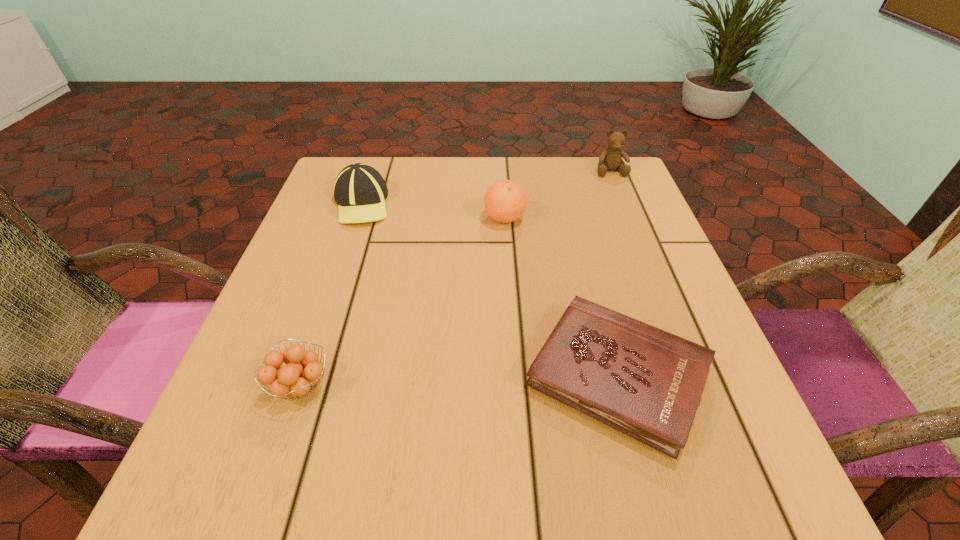
Where is `teddy bear`? teddy bear is located at coordinates (610, 159).

Where is `the right orange fruit`? The image size is (960, 540). the right orange fruit is located at coordinates (505, 201).

Locate an element on the screen. the taller orange fruit is located at coordinates (505, 201).

At what (x,y) coordinates should I click in order to perform the action: click on baseball cap. Please return your answer as a coordinate pair (x, y). Looking at the image, I should click on (360, 191).

What are the coordinates of `the nearer orange fruit` in the screenshot? It's located at (295, 379).

Locate an element on the screen. the shorter orange fruit is located at coordinates (295, 379).

At what (x,y) coordinates should I click in order to perform the action: click on hardback book. Please return your answer as a coordinate pair (x, y). Image resolution: width=960 pixels, height=540 pixels. Looking at the image, I should click on (647, 383).

Locate an element on the screen. vacant space located 0.400m on the front-facing side of the teddy bear is located at coordinates (660, 293).

Where is `free location located 0.060m on the right of the farther orange fruit`? The image size is (960, 540). free location located 0.060m on the right of the farther orange fruit is located at coordinates (552, 218).

Find the location of `free space located 0.330m with the brim of the baseball cap facing forward`. free space located 0.330m with the brim of the baseball cap facing forward is located at coordinates point(311,353).